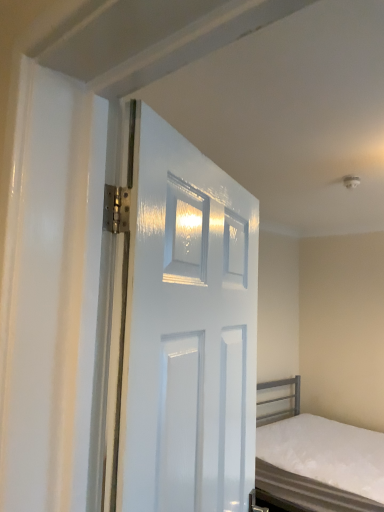
Question: Considering the positions of white glossy door at center and white matte bed at lower right in the image, is white glossy door at center taller or shorter than white matte bed at lower right?

Choices:
 (A) short
 (B) tall

Answer: (B)

Question: Would you say white glossy door at center is to the left or to the right of white matte bed at lower right in the picture?

Choices:
 (A) left
 (B) right

Answer: (A)

Question: Relative to white matte bed at lower right, is white glossy door at center in front or behind?

Choices:
 (A) behind
 (B) front

Answer: (B)

Question: Is white matte bed at lower right inside the boundaries of white glossy door at center, or outside?

Choices:
 (A) inside
 (B) outside

Answer: (B)

Question: Based on their sizes in the image, would you say white matte bed at lower right is bigger or smaller than white glossy door at center?

Choices:
 (A) small
 (B) big

Answer: (B)

Question: From the image's perspective, relative to white glossy door at center, is white matte bed at lower right above or below?

Choices:
 (A) above
 (B) below

Answer: (B)

Question: Is point (382, 501) positioned closer to the camera than point (228, 409)?

Choices:
 (A) closer
 (B) farther

Answer: (B)